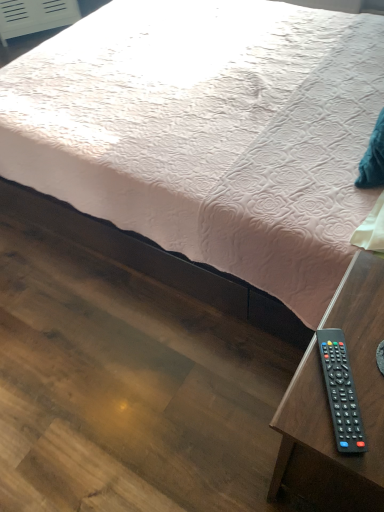
What do you see at coordinates (328, 405) in the screenshot? The image size is (384, 512). I see `black plastic remote at lower right` at bounding box center [328, 405].

Identify the location of pink quilted fabric at center. (208, 132).

Who is taller, pink quilted fabric at center or black plastic remote at lower right?

pink quilted fabric at center is taller.

Does pink quilted fabric at center have a greater width compared to black plastic remote at lower right?

Yes, pink quilted fabric at center is wider than black plastic remote at lower right.

How different are the orientations of pink quilted fabric at center and black plastic remote at lower right in degrees?

They differ by 31.9 degrees in their facing directions.

Identify the location of table that appears below the pink quilted fabric at center (from a real-world perspective). The width and height of the screenshot is (384, 512). (328, 405).

Is there a large distance between black plastic remote at lower right and pink quilted fabric at center?

No, black plastic remote at lower right is in close proximity to pink quilted fabric at center.

Is black plastic remote at lower right taller than pink quilted fabric at center?

No.

Which object is more forward, black plastic remote at lower right or pink quilted fabric at center?

black plastic remote at lower right.

Is black plastic remote at lower right looking in the opposite direction of pink quilted fabric at center?

No.

Are black plastic remote at lower right and pink quilted fabric at center located far from each other?

Absolutely, black plastic remote at lower right is distant from pink quilted fabric at center.

Which is closer, (x=344, y=367) or (x=83, y=162)?

Point (x=344, y=367) is positioned closer to the camera compared to point (x=83, y=162).

Who is smaller, black plastic remote at lower right or pink quilted fabric at center?

With smaller size is black plastic remote at lower right.

Which of these two, pink quilted fabric at center or black plastic remote at lower right, is wider?

pink quilted fabric at center.

Is pink quilted fabric at center not within black plastic remote at lower right?

pink quilted fabric at center lies outside black plastic remote at lower right's area.

From a real-world perspective, between pink quilted fabric at center and black plastic remote at lower right, who is vertically higher?

From a 3D spatial view, pink quilted fabric at center is above.

At what (x,y) coordinates should I click in order to perform the action: click on bed that is on the left side of black plastic remote at lower right. Please return your answer as a coordinate pair (x, y). Looking at the image, I should click on (208, 132).

Can you tell me how much black plastic remote at lower right and black plastic remote at lower right differ in facing direction?

31.9 degrees separate the facing orientations of black plastic remote at lower right and black plastic remote at lower right.

Measure the distance from black plastic remote at lower right to black plastic remote at lower right.

The distance of black plastic remote at lower right from black plastic remote at lower right is 16.87 centimeters.

Is black plastic remote at lower right looking in the opposite direction of black plastic remote at lower right?

black plastic remote at lower right does not have its back to black plastic remote at lower right.

Can you confirm if black plastic remote at lower right is positioned to the left of black plastic remote at lower right?

Yes.

Are black plastic remote at lower right and black plastic remote at lower right located far from each other?

That's not correct — black plastic remote at lower right is a little close to black plastic remote at lower right.

Is point (378, 266) closer or farther from the camera than point (345, 388)?

Point (378, 266) is positioned farther from the camera compared to point (345, 388).

Considering the relative sizes of black plastic remote at lower right and black plastic remote at lower right in the image provided, is black plastic remote at lower right bigger than black plastic remote at lower right?

Indeed, black plastic remote at lower right has a larger size compared to black plastic remote at lower right.

From a real-world perspective, is black plastic remote at lower right on black plastic remote at lower right?

Incorrect, from a real-world perspective, black plastic remote at lower right is lower than black plastic remote at lower right.

The width and height of the screenshot is (384, 512). Find the location of `bed that appears on the left of black plastic remote at lower right`. bed that appears on the left of black plastic remote at lower right is located at coordinates (208, 132).

Find the location of `table below the pink quilted fabric at center (from a real-world perspective)`. table below the pink quilted fabric at center (from a real-world perspective) is located at coordinates (328, 405).

Looking at the image, which one is located closer to pink quilted fabric at center, black plastic remote at lower right or black plastic remote at lower right?

black plastic remote at lower right is positioned closer to the anchor pink quilted fabric at center.

Which object lies nearer to the anchor point black plastic remote at lower right, pink quilted fabric at center or black plastic remote at lower right?

The object closer to black plastic remote at lower right is black plastic remote at lower right.

Looking at the image, which one is located closer to black plastic remote at lower right, black plastic remote at lower right or pink quilted fabric at center?

black plastic remote at lower right.

From the image, which object appears to be farther from black plastic remote at lower right, pink quilted fabric at center or black plastic remote at lower right?

pink quilted fabric at center is further to black plastic remote at lower right.

Estimate the real-world distances between objects in this image. Which object is closer to black plastic remote at lower right, black plastic remote at lower right or pink quilted fabric at center?

black plastic remote at lower right lies closer to black plastic remote at lower right than the other object.

Based on their spatial positions, is black plastic remote at lower right or black plastic remote at lower right further from pink quilted fabric at center?

Among the two, black plastic remote at lower right is located further to pink quilted fabric at center.

Image resolution: width=384 pixels, height=512 pixels. I want to click on remote control between pink quilted fabric at center and black plastic remote at lower right in the up-down direction, so click(x=341, y=392).